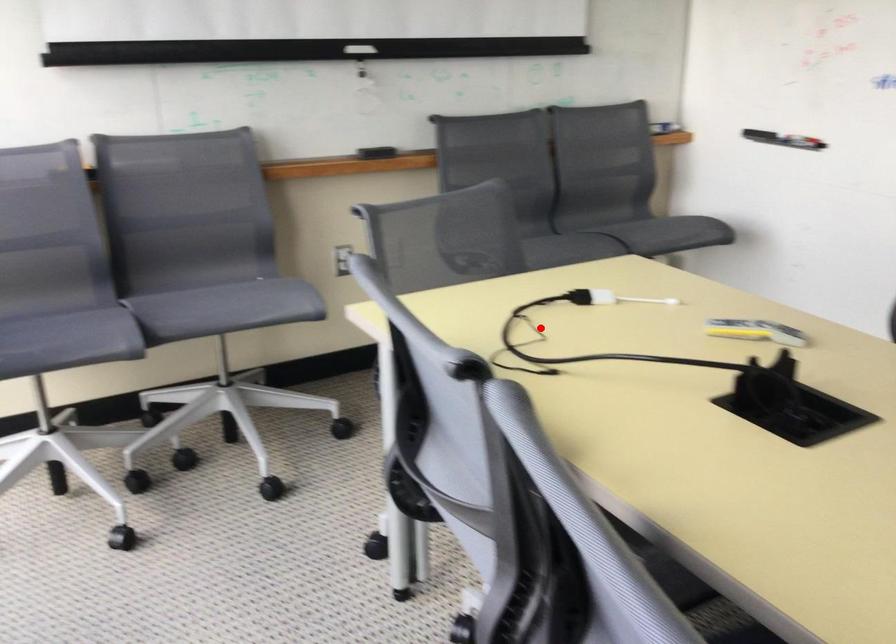
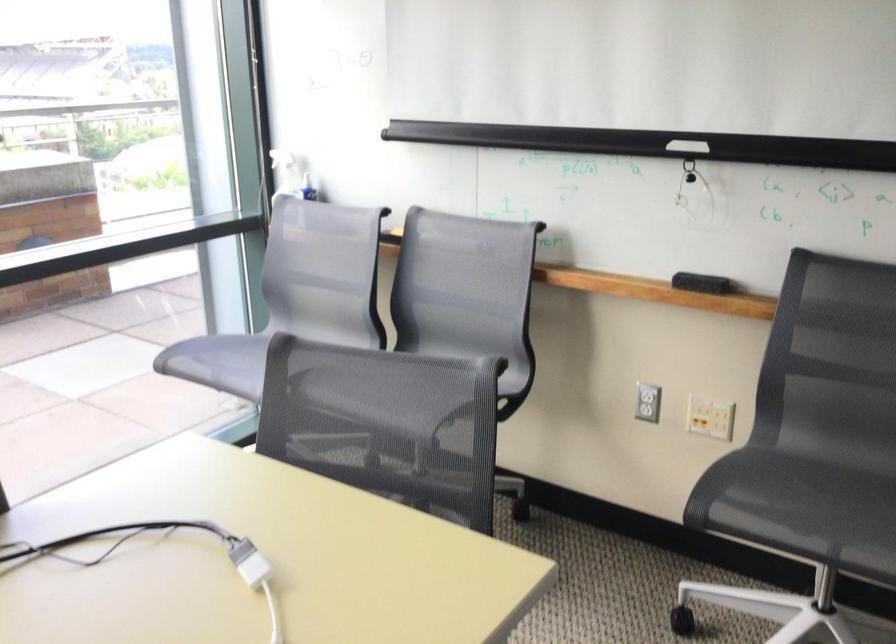
Locate, in the second image, the point that corresponds to the highlighted location in the first image.

(161, 554)